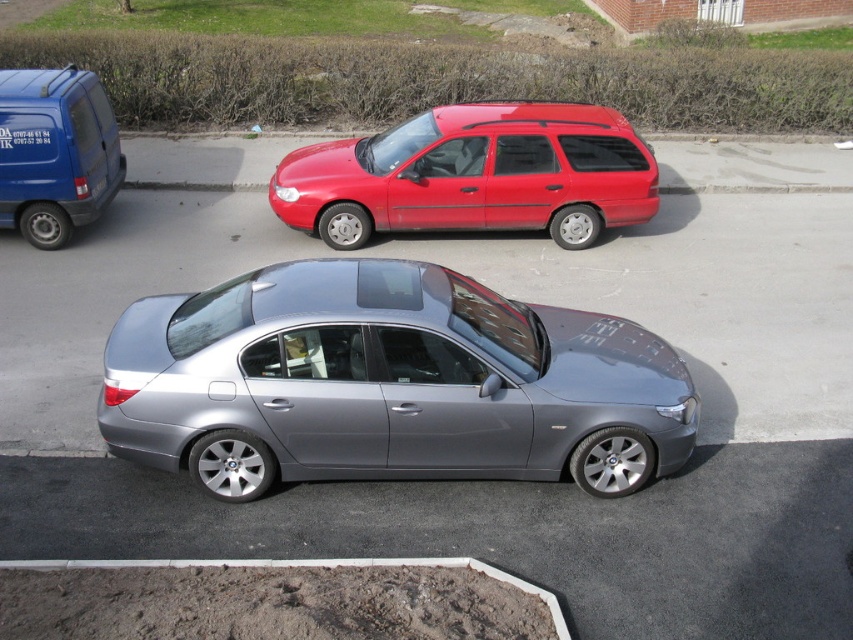
Question: Can you confirm if matte blue van at left is positioned to the right of black plastic license plate at center?

Choices:
 (A) no
 (B) yes

Answer: (A)

Question: Does satin metallic sedan at center have a greater width compared to shiny red station wagon at center?

Choices:
 (A) yes
 (B) no

Answer: (B)

Question: Which of these objects is positioned farthest from the black plastic license plate at center?

Choices:
 (A) matte blue van at left
 (B) shiny red station wagon at center

Answer: (B)

Question: Is satin metallic sedan at center further to the viewer compared to matte blue van at left?

Choices:
 (A) no
 (B) yes

Answer: (A)

Question: Which point is closer to the camera taking this photo?

Choices:
 (A) (277, 188)
 (B) (659, 419)
 (C) (105, 180)
 (D) (28, 72)

Answer: (B)

Question: Which object is farther from the camera taking this photo?

Choices:
 (A) shiny red station wagon at center
 (B) satin metallic sedan at center
 (C) black plastic license plate at center

Answer: (A)